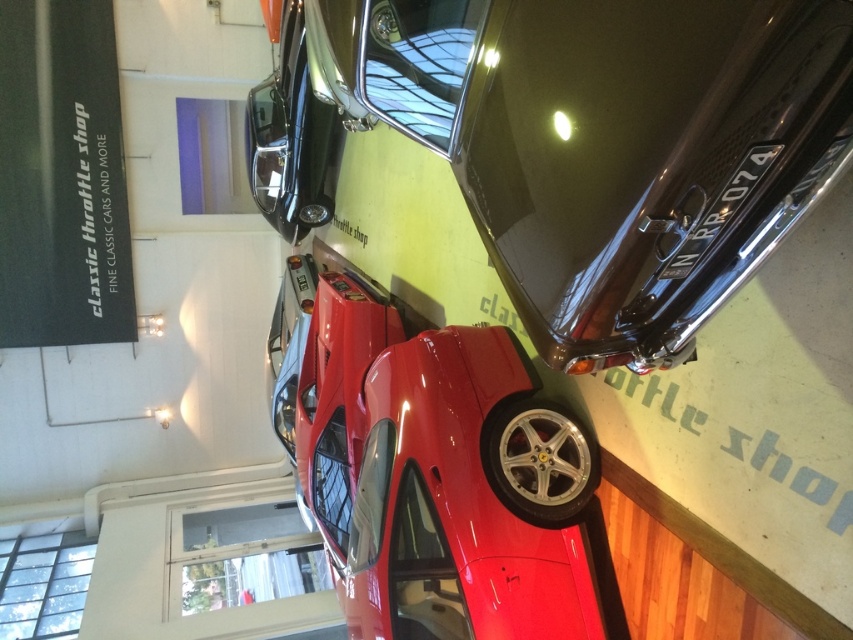
You are a tour guide in the Classic Throttle Shop showroom. You need to guide visitors from the entrance to the vintage car display area. The entrance is at point (799, 208) and the vintage car display area is at point (436, 369). Is the entrance in front of or behind the vintage car display area?

Point (799, 208) is in front of point (436, 369), so the entrance is in front of the vintage car display area.